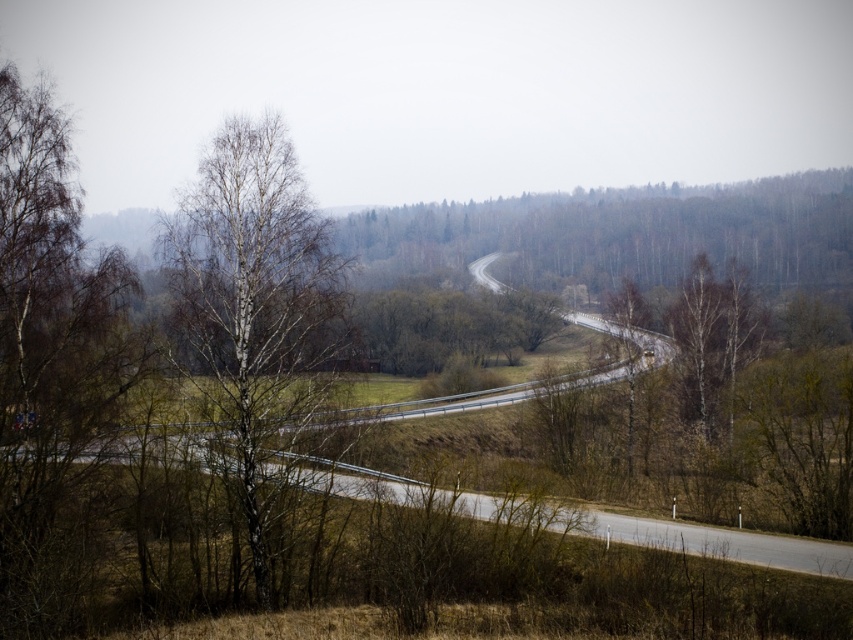
You are standing at the starting point of the road in the image and want to reach the white bark tree at center. In which direction should you walk relative to the road?

Since the white bark tree at center is located at the 2D coordinates point (254, 307), it is positioned near the center of the image. To reach it from the starting point of the road, you should walk towards the center of the image, which would be perpendicular to the road direction if the road curves or along the road if it is straight. However, based on the scene description mentioning a curving road, you should follow the road towards the center area where the white bark tree at center is located.

You are a hiker standing at the point marked as point (254,307) in the image. Which object are you standing on?

The point (254,307) is on the white bark tree at center, so you are standing on the white bark tree at center.